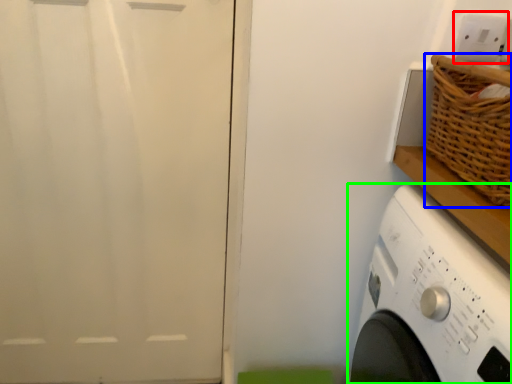
Question: Which object is the closest to the electric outlet (highlighted by a red box)? Choose among these: basket (highlighted by a blue box) or washing machine (highlighted by a green box).

Choices:
 (A) basket
 (B) washing machine

Answer: (A)